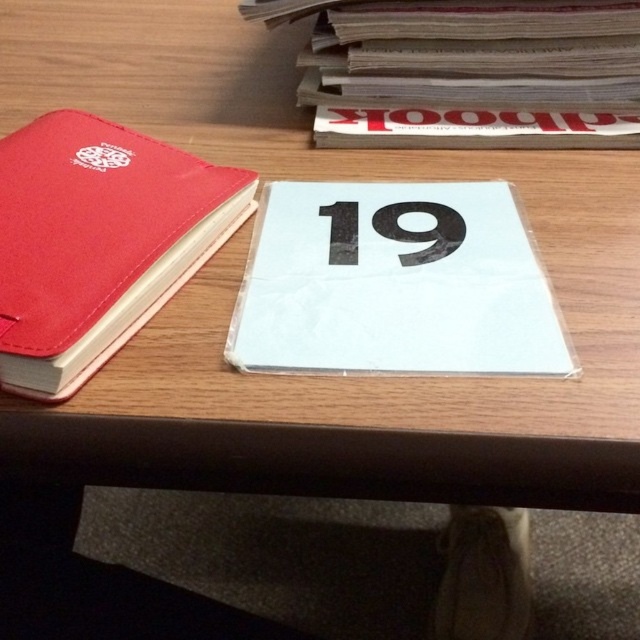
Which is above, matte red notebook at left or black paper at center?

matte red notebook at left

Looking at this image, who is more distant from viewer, (64, 118) or (456, 211)?

The point (64, 118) is behind.

Which is behind, point (67, 320) or point (339, 260)?

Point (339, 260)

The height and width of the screenshot is (640, 640). What are the coordinates of `matte red notebook at left` in the screenshot? It's located at (97, 241).

Can you confirm if matte red notebook at left is bigger than gray paper book at upper right?

Correct, matte red notebook at left is larger in size than gray paper book at upper right.

Identify the location of matte red notebook at left. Image resolution: width=640 pixels, height=640 pixels. (97, 241).

Who is positioned more to the left, white paper card at center or matte red notebook at left?

matte red notebook at left is more to the left.

Which is above, white paper card at center or matte red notebook at left?

matte red notebook at left is higher up.

Locate an element on the screen. The image size is (640, 640). white paper card at center is located at coordinates (394, 284).